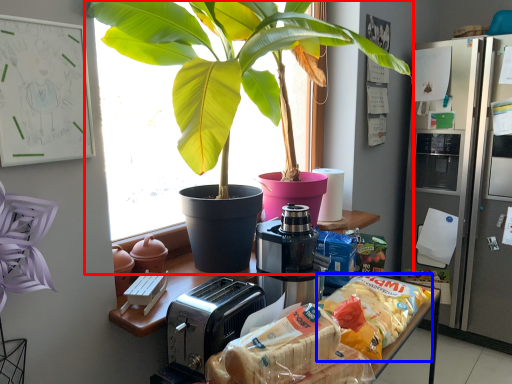
Question: Among these objects, which one is nearest to the camera, houseplant (highlighted by a red box) or snack (highlighted by a blue box)?

Choices:
 (A) houseplant
 (B) snack

Answer: (A)